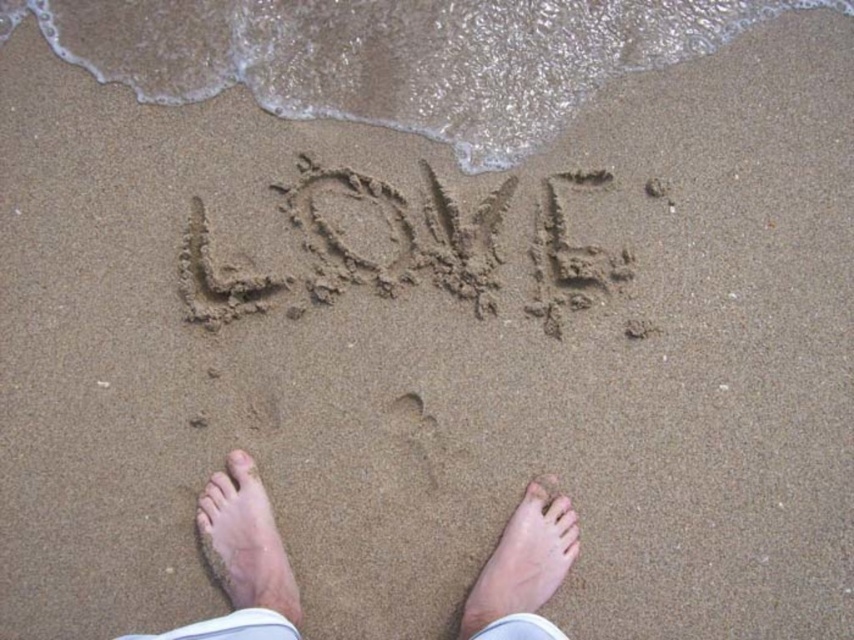
You are a photographer trying to capture the word LOVE written in the sand. You notice two feet in the frame. Which foot is closer to the camera? The skin tone bare feet at center or the light skin tone foot at lower center?

The light skin tone foot at lower center is closer to the camera because it is smaller than the skin tone bare feet at center, which is bigger and therefore farther away.

You are a photographer trying to capture the word LOVE written in the sand. You notice the dark brown sand at center and the light skin tone foot at lower center. Which object is higher up in the image?

The dark brown sand at center is taller than the light skin tone foot at lower center, so the dark brown sand at center is higher up in the image.